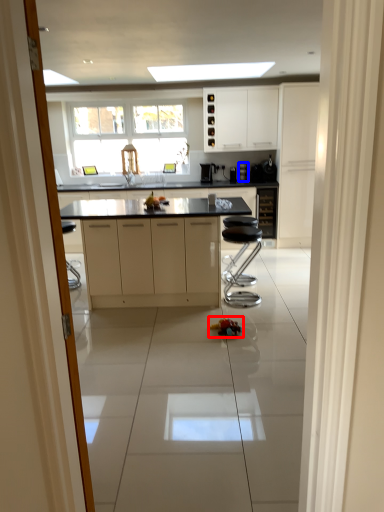
Question: Which of the following is the closest to the observer, toy (highlighted by a red box) or coffee machine (highlighted by a blue box)?

Choices:
 (A) toy
 (B) coffee machine

Answer: (A)